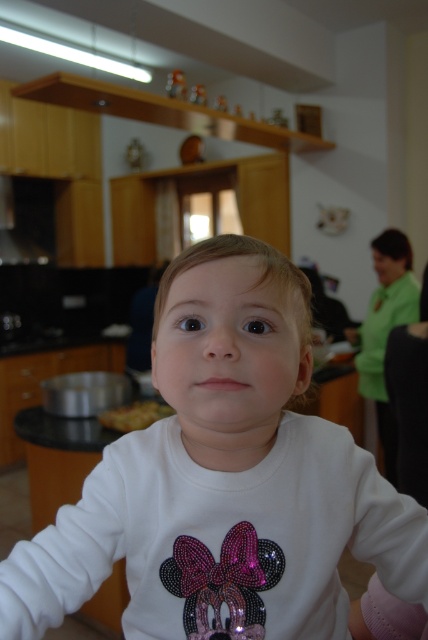
Does white matte shirt at center have a lesser width compared to yellowish matte food at lower left?

In fact, white matte shirt at center might be wider than yellowish matte food at lower left.

Is white matte shirt at center further to camera compared to yellowish matte food at lower left?

That is False.

Who is more forward, (48, 580) or (104, 426)?

Point (48, 580) is more forward.

This screenshot has width=428, height=640. I want to click on white matte shirt at center, so click(223, 481).